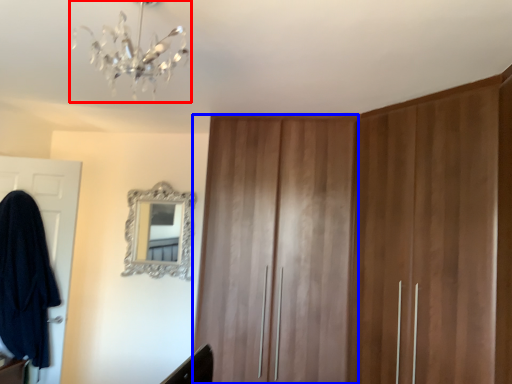
Question: Which object appears closest to the camera in this image, light fixture (highlighted by a red box) or locker (highlighted by a blue box)?

Choices:
 (A) light fixture
 (B) locker

Answer: (A)